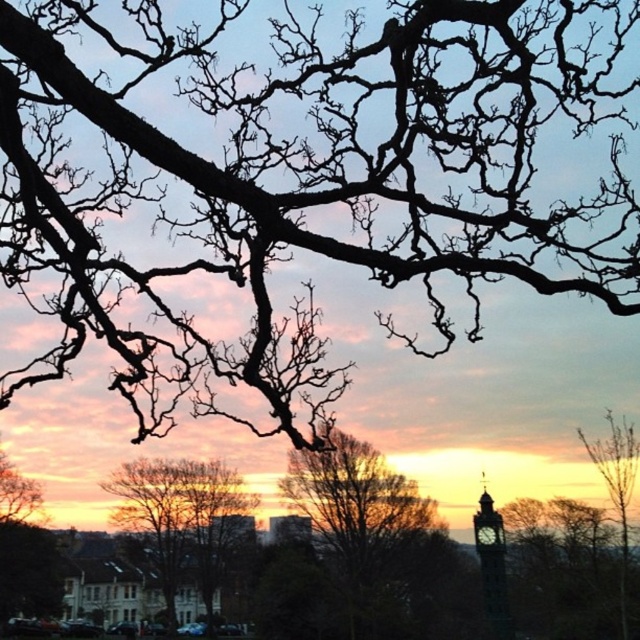
You are standing at the center of the image and want to walk towards the dark gray stone clock tower at lower right. Which direction should you head?

The dark gray stone clock tower at lower right is located at coordinates point (492, 564), so you should head towards the lower right direction to reach it.

You are an artist trying to sketch this sunset scene. You want to ensure the smooth brown tree at center and the dark gray stone clock tower at lower right are proportionally accurate. Which object should you draw wider?

The smooth brown tree at center should be drawn wider because its width surpasses the dark gray stone clock tower at lower right.

You are an artist sketching the sunset scene. You need to place the black bare branches at upper center and the dark gray stone clock tower at lower right in your drawing. Based on the scene description, which object should you draw first to ensure proper layering?

The black bare branches at upper center should be drawn first because it is positioned on the left side of the dark gray stone clock tower at lower right, meaning it is in front of the tower and requires layering over the background elements.